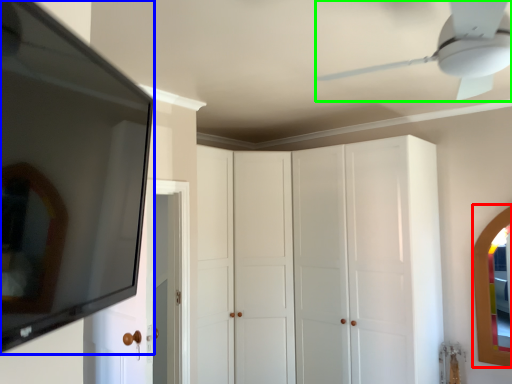
Question: Considering the real-world distances, which object is closest to mirror (highlighted by a red box)? mirror (highlighted by a blue box) or ceiling fan (highlighted by a green box).

Choices:
 (A) mirror
 (B) ceiling fan

Answer: (B)